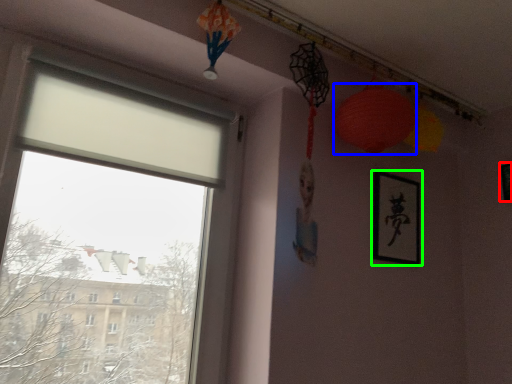
Question: Estimate the real-world distances between objects in this image. Which object is farther from picture frame (highlighted by a red box), lantern (highlighted by a blue box) or picture frame (highlighted by a green box)?

Choices:
 (A) lantern
 (B) picture frame

Answer: (A)